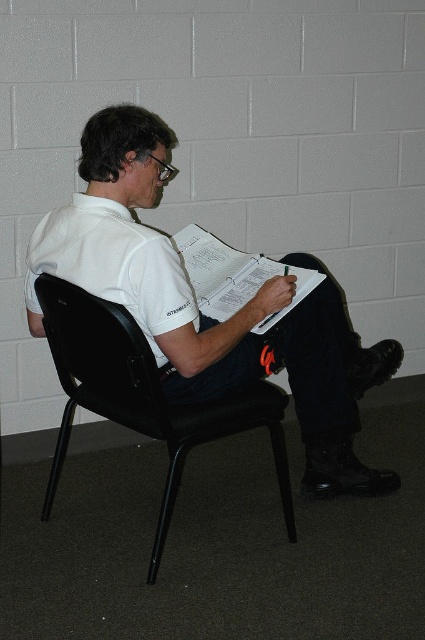
Can you confirm if white matte shirt at center is thinner than white paper clipboard at center?

Incorrect, white matte shirt at center's width is not less than white paper clipboard at center's.

Does white matte shirt at center have a greater height compared to white paper clipboard at center?

Yes, white matte shirt at center is taller than white paper clipboard at center.

Image resolution: width=425 pixels, height=640 pixels. What are the coordinates of `white matte shirt at center` in the screenshot? It's located at (198, 310).

This screenshot has width=425, height=640. I want to click on white matte shirt at center, so click(x=198, y=310).

Can you confirm if white matte shirt at center is positioned above black plastic chair at center?

Yes.

At what (x,y) coordinates should I click in order to perform the action: click on white matte shirt at center. Please return your answer as a coordinate pair (x, y). The height and width of the screenshot is (640, 425). Looking at the image, I should click on (198, 310).

What are the coordinates of `white matte shirt at center` in the screenshot? It's located at (198, 310).

What are the coordinates of `white matte shirt at center` in the screenshot? It's located at (198, 310).

Which is in front, point (136, 364) or point (221, 269)?

Point (136, 364) is more forward.

Who is more forward, (76, 348) or (246, 301)?

Positioned in front is point (76, 348).

The image size is (425, 640). In order to click on black plastic chair at center in this screenshot , I will do `click(142, 396)`.